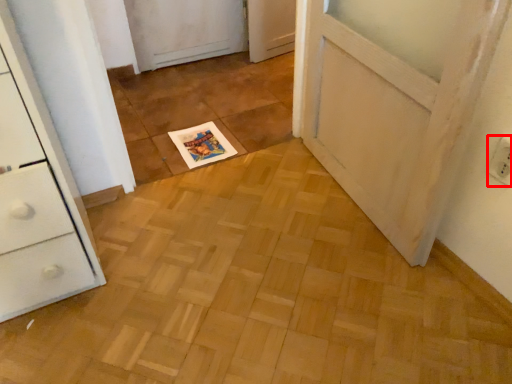
Question: From the image, what is the correct spatial relationship of electric outlet (annotated by the red box) in relation to magazine?

Choices:
 (A) right
 (B) left

Answer: (A)